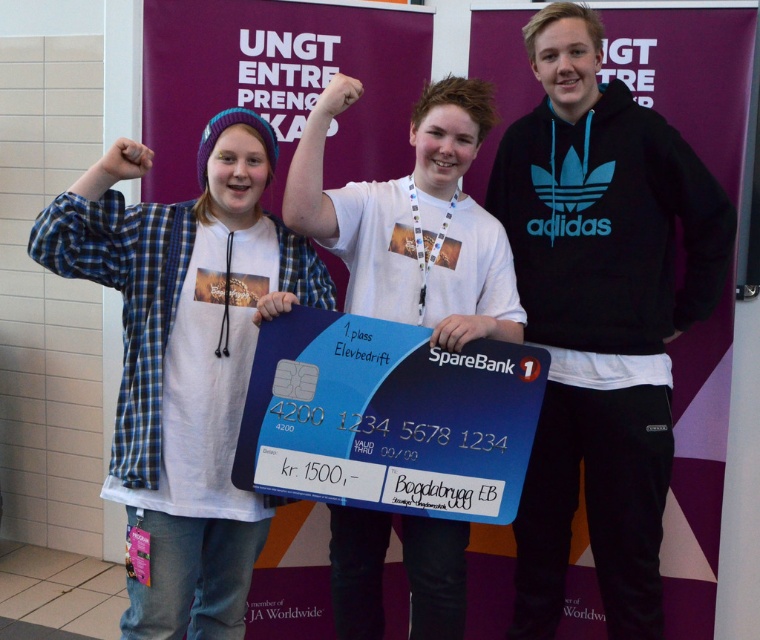
Question: Considering the relative positions of black fleece sweatshirt at right and matte blue card at center in the image provided, where is black fleece sweatshirt at right located with respect to matte blue card at center?

Choices:
 (A) left
 (B) right

Answer: (B)

Question: Which object is positioned farthest from the black fleece sweatshirt at right?

Choices:
 (A) matte blue card at center
 (B) white matte t-shirt at center

Answer: (A)

Question: Which point is farther to the camera?

Choices:
 (A) (198, 308)
 (B) (347, 230)

Answer: (B)

Question: Considering the relative positions of black fleece sweatshirt at right and white matte t-shirt at center in the image provided, where is black fleece sweatshirt at right located with respect to white matte t-shirt at center?

Choices:
 (A) left
 (B) right

Answer: (B)

Question: Which of the following is the closest to the observer?

Choices:
 (A) (466, 326)
 (B) (561, 385)

Answer: (A)

Question: Is black fleece sweatshirt at right to the left of white matte t-shirt at center from the viewer's perspective?

Choices:
 (A) no
 (B) yes

Answer: (A)